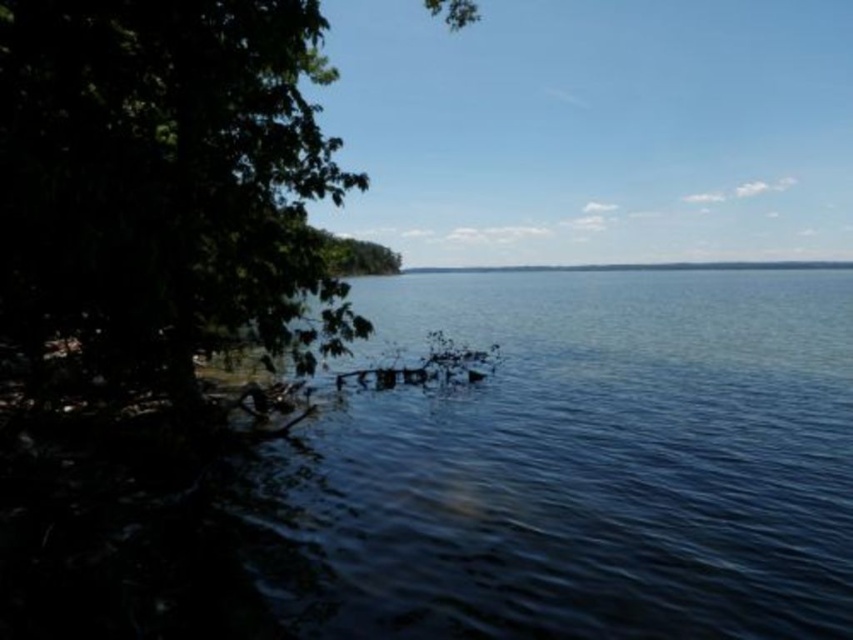
Question: From the image, what is the correct spatial relationship of green leafy tree at left in relation to green leafy tree at center?

Choices:
 (A) above
 (B) below

Answer: (B)

Question: Is green leafy tree at left closer to camera compared to green leafy tree at center?

Choices:
 (A) no
 (B) yes

Answer: (B)

Question: Which object is closer to the camera taking this photo?

Choices:
 (A) green leafy tree at left
 (B) green leafy tree at center

Answer: (A)

Question: Does green leafy tree at left appear over green leafy tree at center?

Choices:
 (A) no
 (B) yes

Answer: (A)